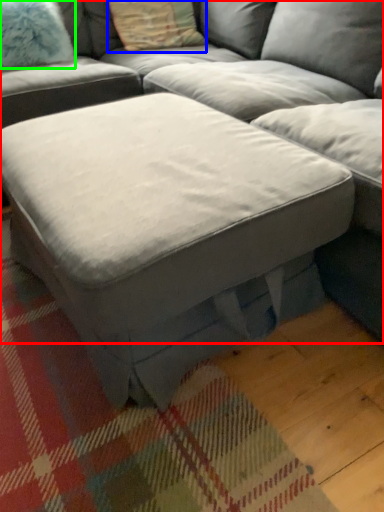
Question: Which object is positioned farthest from studio couch (highlighted by a red box)? Select from pillow (highlighted by a blue box) and pillow (highlighted by a green box).

Choices:
 (A) pillow
 (B) pillow

Answer: (B)